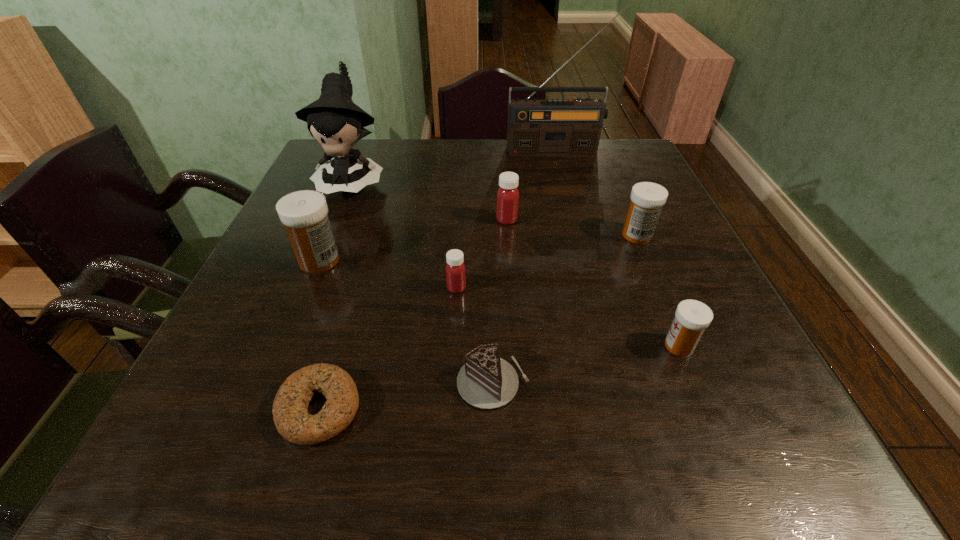
Where is `the second medicine from left to right`? Image resolution: width=960 pixels, height=540 pixels. the second medicine from left to right is located at coordinates (455, 269).

This screenshot has height=540, width=960. What are the coordinates of `the smallest white medicine` in the screenshot? It's located at (692, 317).

The width and height of the screenshot is (960, 540). I want to click on the nearest medicine, so click(692, 317).

The width and height of the screenshot is (960, 540). I want to click on the second shortest object, so click(x=486, y=381).

The width and height of the screenshot is (960, 540). I want to click on brown bagel, so click(x=290, y=412).

Find the location of a particular element. bagel is located at coordinates (290, 412).

The image size is (960, 540). I want to click on free space located 0.360m on the front-facing side of the farthest object, so click(578, 230).

The height and width of the screenshot is (540, 960). What are the coordinates of `free space located at the face of the eighth shortest object` in the screenshot? It's located at (309, 290).

Identify the location of free spot located on the right of the fifth nearest object. (433, 261).

This screenshot has height=540, width=960. I want to click on vacant area situated 0.290m on the back of the second biggest white medicine, so click(x=608, y=165).